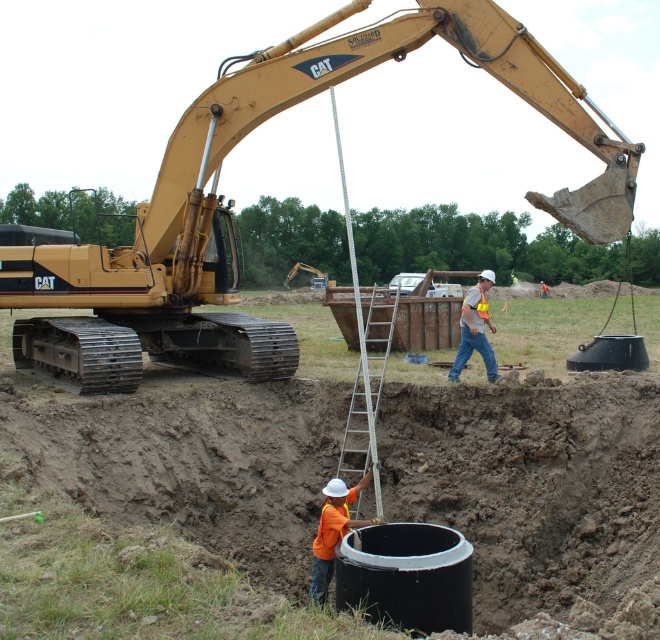
Who is lower down, yellow metallic excavator at upper left or orange reflective vest at center?

Positioned lower is orange reflective vest at center.

Does point (178, 356) lie behind point (475, 324)?

Yes, it is.

The height and width of the screenshot is (640, 660). What do you see at coordinates (232, 204) in the screenshot? I see `yellow metallic excavator at upper left` at bounding box center [232, 204].

Find the location of a particular element. This screenshot has height=640, width=660. yellow metallic excavator at upper left is located at coordinates (232, 204).

Is yellow metallic excavator at upper left further to the viewer compared to orange fabric construction worker at lower center?

Yes, yellow metallic excavator at upper left is further from the viewer.

Can you confirm if yellow metallic excavator at upper left is positioned to the left of orange fabric construction worker at lower center?

Yes, yellow metallic excavator at upper left is to the left of orange fabric construction worker at lower center.

What do you see at coordinates (232, 204) in the screenshot? I see `yellow metallic excavator at upper left` at bounding box center [232, 204].

Image resolution: width=660 pixels, height=640 pixels. I want to click on yellow metallic excavator at upper left, so click(232, 204).

Does silver metallic ladder at center appear over orange fabric construction worker at lower center?

Yes.

Does point (354, 440) come farther from viewer compared to point (314, 556)?

That is True.

Measure the distance between point (343, 458) and camera.

A distance of 9.65 meters exists between point (343, 458) and camera.

Image resolution: width=660 pixels, height=640 pixels. I want to click on silver metallic ladder at center, so click(x=368, y=380).